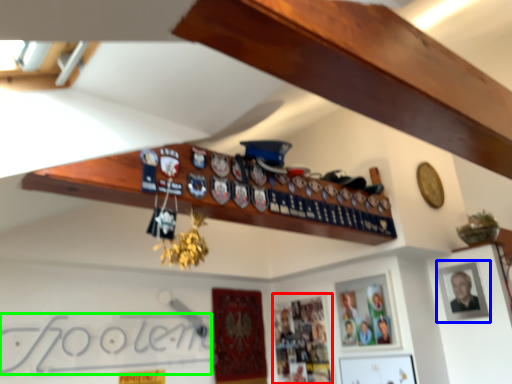
Question: Estimate the real-world distances between objects in this image. Which object is closer to picture frame (highlighted by a red box), picture frame (highlighted by a blue box) or signature (highlighted by a green box)?

Choices:
 (A) picture frame
 (B) signature

Answer: (B)